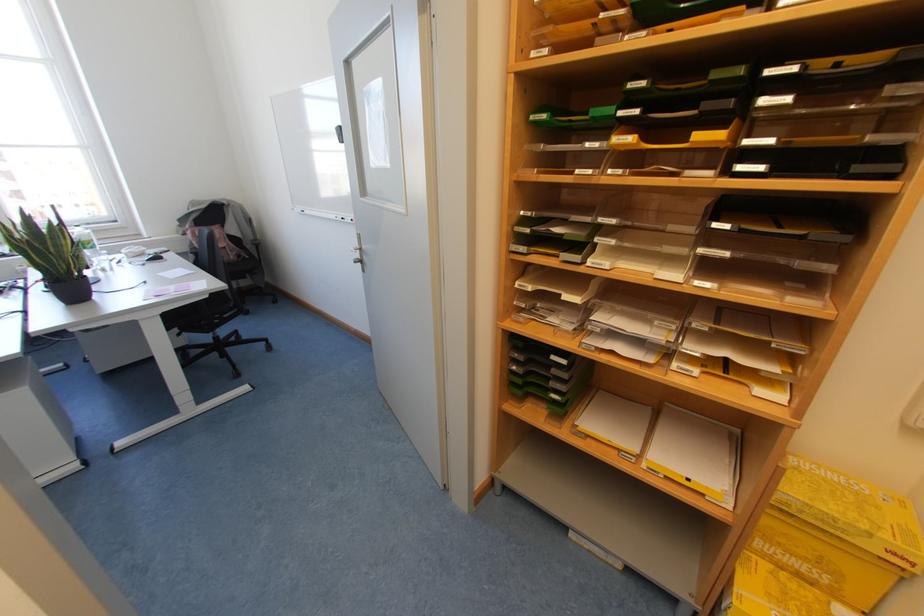
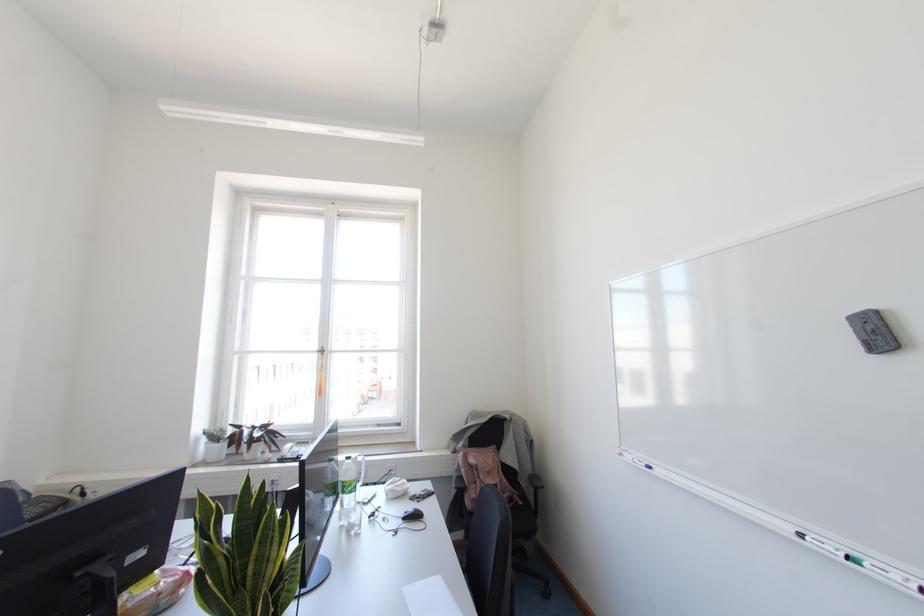
Where in the second image is the point corresponding to the point at 302,211 from the first image?

(649, 467)